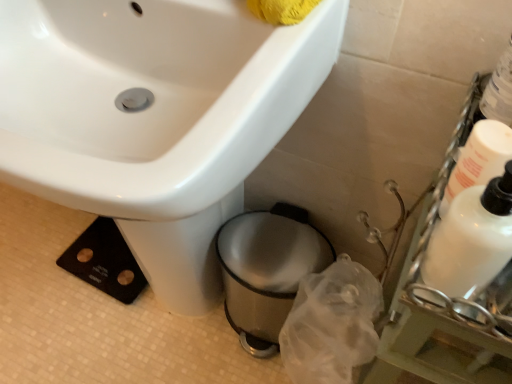
Locate an element on the screen. vacant space underneath white glossy sink at upper left (from a real-world perspective) is located at coordinates (146, 324).